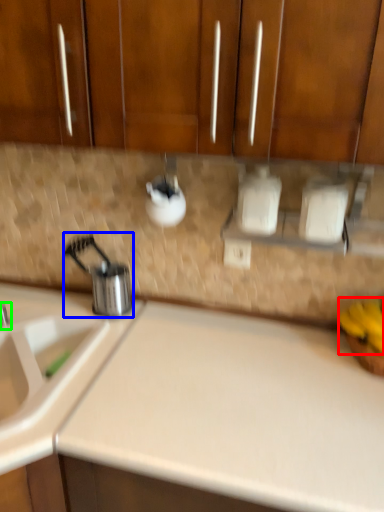
Question: Which object is positioned closest to banana (highlighted by a red box)? Select from appliance (highlighted by a blue box) and tap (highlighted by a green box).

Choices:
 (A) appliance
 (B) tap

Answer: (A)